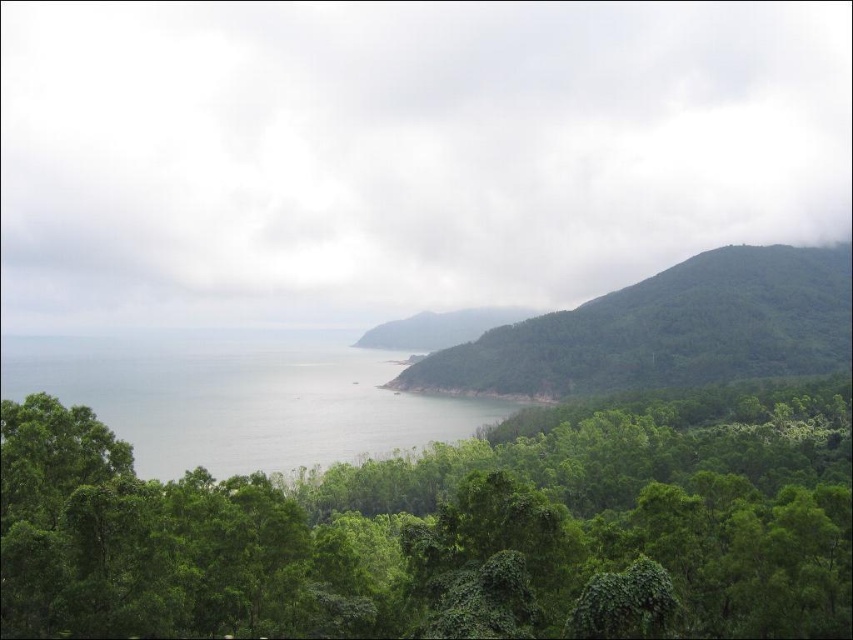
You are a photographer standing at the center of the scene. You want to capture the clear water at lower left in your shot. Based on its 2D coordinates, which direction should you point your camera to frame it properly?

The clear water at lower left is located at point 0.622 on the x axis and 0.283 on the y axis. Since the x coordinate is greater than 0.5, it means it is to the right of the center. The y coordinate is less than 0.5, so it is below the center. Therefore, you should point your camera to the lower right direction to frame the clear water at lower left properly.

You are a hiker who wants to take a photo of the clear water at lower left. To get the best shot, you need to position yourself so that the green leafy trees at center are partially framing the view. Based on the scene, is this possible?

Yes, because the green leafy trees at center are in front of the clear water at lower left, positioning yourself behind the trees would allow them to frame the water in the background.